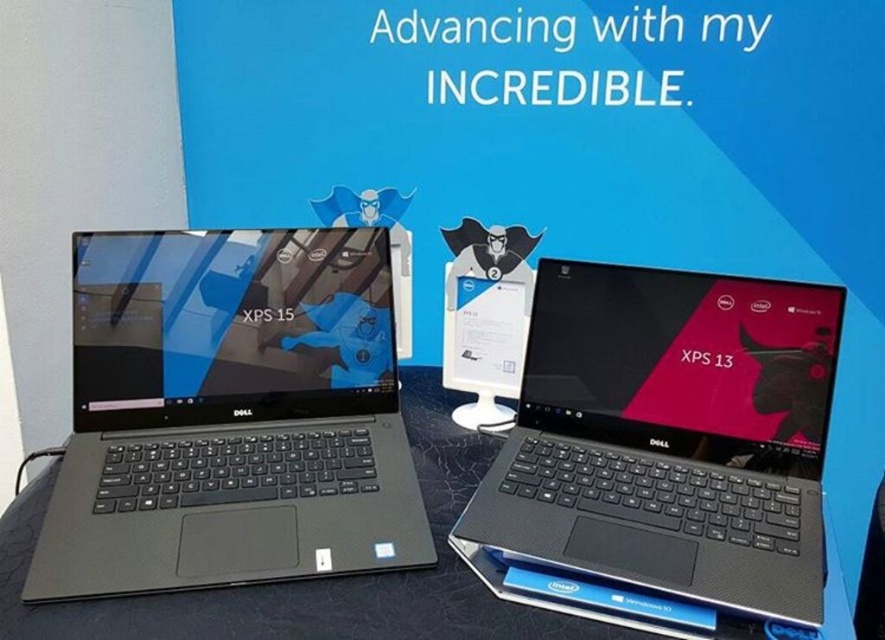
Question: Can you confirm if matte black laptop at left is positioned to the left of black matte table at center?

Choices:
 (A) no
 (B) yes

Answer: (B)

Question: Is matte black laptop at left wider than matte black laptop at center?

Choices:
 (A) no
 (B) yes

Answer: (B)

Question: Which point is farther from the camera taking this photo?

Choices:
 (A) (252, 307)
 (B) (183, 595)

Answer: (A)

Question: Which point is farther from the camera taking this photo?

Choices:
 (A) (x=470, y=582)
 (B) (x=575, y=337)

Answer: (B)

Question: Which object is positioned farthest from the black matte table at center?

Choices:
 (A) matte black laptop at left
 (B) matte black laptop at center

Answer: (B)

Question: Can you confirm if matte black laptop at left is positioned above matte black laptop at center?

Choices:
 (A) yes
 (B) no

Answer: (A)